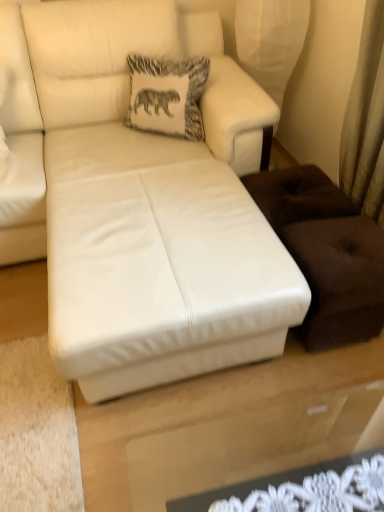
Describe the element at coordinates (142, 199) in the screenshot. I see `white leather couch at center` at that location.

Measure the distance between white leather couch at center and camera.

white leather couch at center is 1.10 meters away from camera.

What are the coordinates of `white leather couch at center` in the screenshot? It's located at (142, 199).

This screenshot has height=512, width=384. Identify the location of white fabric pillow with elephant print at upper center. (167, 96).

Image resolution: width=384 pixels, height=512 pixels. Describe the element at coordinates (167, 96) in the screenshot. I see `white fabric pillow with elephant print at upper center` at that location.

Identify the location of white leather couch at center. (142, 199).

Which object is positioned more to the right, white fabric pillow with elephant print at upper center or white leather couch at center?

white leather couch at center is more to the right.

Is white fabric pillow with elephant print at upper center in front of or behind white leather couch at center in the image?

Clearly, white fabric pillow with elephant print at upper center is behind white leather couch at center.

Is point (185, 94) closer to camera compared to point (143, 135)?

Yes, it is in front of point (143, 135).

From the image's perspective, is white fabric pillow with elephant print at upper center above white leather couch at center?

Yes, from the image's perspective, white fabric pillow with elephant print at upper center is above white leather couch at center.

From a real-world perspective, which is physically above, white fabric pillow with elephant print at upper center or white leather couch at center?

From a 3D spatial view, white fabric pillow with elephant print at upper center is above.

Considering the sizes of objects white fabric pillow with elephant print at upper center and white leather couch at center in the image provided, who is wider, white fabric pillow with elephant print at upper center or white leather couch at center?

white leather couch at center is wider.

In terms of height, does white fabric pillow with elephant print at upper center look taller or shorter compared to white leather couch at center?

Considering their sizes, white fabric pillow with elephant print at upper center has less height than white leather couch at center.

Can you confirm if white fabric pillow with elephant print at upper center is bigger than white leather couch at center?

Actually, white fabric pillow with elephant print at upper center might be smaller than white leather couch at center.

Would you say white fabric pillow with elephant print at upper center is inside or outside white leather couch at center?

white fabric pillow with elephant print at upper center is enclosed within white leather couch at center.

Is white fabric pillow with elephant print at upper center next to white leather couch at center and touching it?

No, white fabric pillow with elephant print at upper center is not making contact with white leather couch at center.

Is white fabric pillow with elephant print at upper center facing away from white leather couch at center?

Yes, white fabric pillow with elephant print at upper center is facing away from white leather couch at center.

Can you tell me how much white fabric pillow with elephant print at upper center and white leather couch at center differ in facing direction?

The angular difference between white fabric pillow with elephant print at upper center and white leather couch at center is 46.1 degrees.

The image size is (384, 512). I want to click on pillow behind the white leather couch at center, so click(167, 96).

Would you say white leather couch at center is to the left or to the right of white fabric pillow with elephant print at upper center in the picture?

white leather couch at center is positioned on white fabric pillow with elephant print at upper center's right side.

Between white leather couch at center and white fabric pillow with elephant print at upper center, which one is positioned in front?

white leather couch at center is more forward.

Is point (20, 27) closer to viewer compared to point (145, 108)?

Yes.

From the image's perspective, is white leather couch at center below white fabric pillow with elephant print at upper center?

Yes, from the image's perspective, white leather couch at center is beneath white fabric pillow with elephant print at upper center.

From a real-world perspective, is white leather couch at center above or below white fabric pillow with elephant print at upper center?

In terms of real-world spatial position, white leather couch at center is below white fabric pillow with elephant print at upper center.

Is white leather couch at center wider or thinner than white fabric pillow with elephant print at upper center?

Clearly, white leather couch at center has more width compared to white fabric pillow with elephant print at upper center.

Can you confirm if white leather couch at center is taller than white fabric pillow with elephant print at upper center?

Indeed, white leather couch at center has a greater height compared to white fabric pillow with elephant print at upper center.

From the picture: Considering the sizes of white leather couch at center and white fabric pillow with elephant print at upper center in the image, is white leather couch at center bigger or smaller than white fabric pillow with elephant print at upper center?

Considering their sizes, white leather couch at center takes up more space than white fabric pillow with elephant print at upper center.

Do you think white leather couch at center is within white fabric pillow with elephant print at upper center, or outside of it?

The correct answer is: outside.

Is white leather couch at center with white fabric pillow with elephant print at upper center?

white leather couch at center and white fabric pillow with elephant print at upper center are clearly separated.

Is white leather couch at center oriented away from white fabric pillow with elephant print at upper center?

That's right, white leather couch at center is facing away from white fabric pillow with elephant print at upper center.

How many degrees apart are the facing directions of white leather couch at center and white fabric pillow with elephant print at upper center?

white leather couch at center and white fabric pillow with elephant print at upper center are facing 46.1 degrees away from each other.

I want to click on studio couch below the white fabric pillow with elephant print at upper center (from a real-world perspective), so click(142, 199).

I want to click on pillow above the white leather couch at center (from a real-world perspective), so click(x=167, y=96).

You are a GUI agent. You are given a task and a screenshot of the screen. Output one action in this format:
    pyautogui.click(x=<x>, y=<y>)
    Task: Click on the studio couch in front of the white fabric pillow with elephant print at upper center
    The image size is (384, 512).
    Given the screenshot: What is the action you would take?
    pyautogui.click(x=142, y=199)